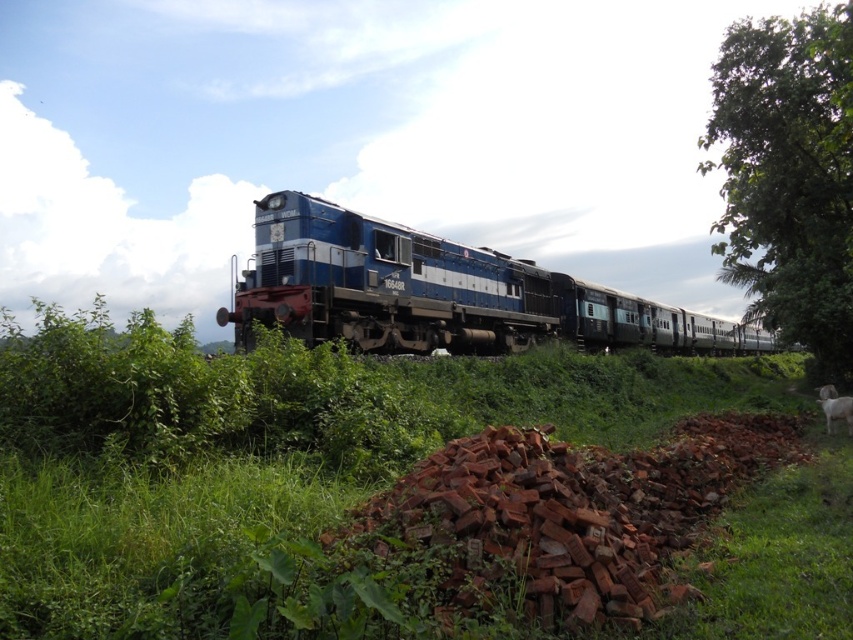
Question: Which of the following is the farthest from the observer?

Choices:
 (A) (827, 417)
 (B) (482, 298)

Answer: (B)

Question: Does green leafy tree at right have a greater width compared to white woolen sheep at lower right?

Choices:
 (A) yes
 (B) no

Answer: (A)

Question: Which object appears closest to the camera in this image?

Choices:
 (A) blue metallic train at center
 (B) green leafy tree at right

Answer: (B)

Question: Does blue metallic train at center have a greater width compared to green leafy tree at right?

Choices:
 (A) no
 (B) yes

Answer: (A)

Question: Which object is positioned closest to the white woolen sheep at lower right?

Choices:
 (A) green leafy tree at right
 (B) blue metallic train at center

Answer: (A)

Question: Is green leafy tree at right smaller than white woolen sheep at lower right?

Choices:
 (A) yes
 (B) no

Answer: (B)